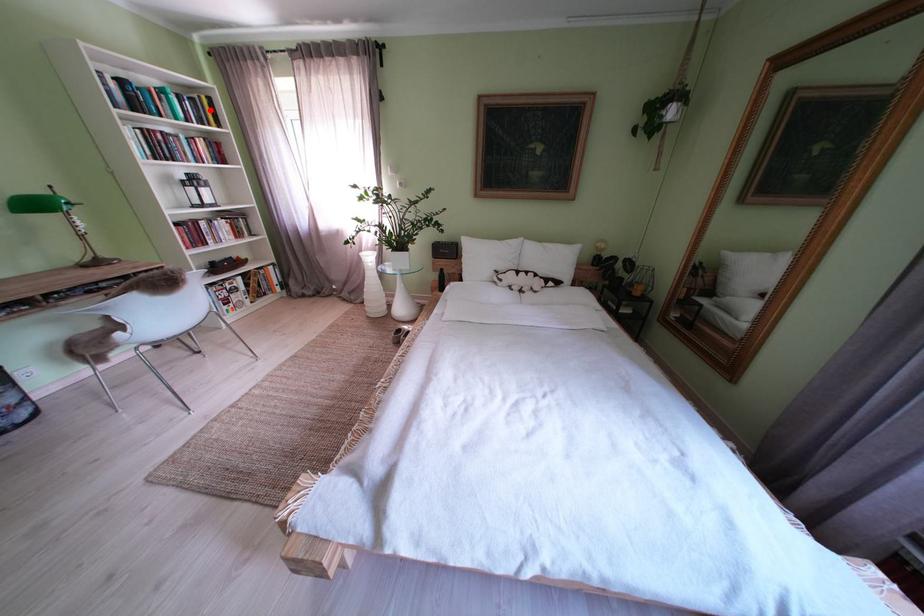
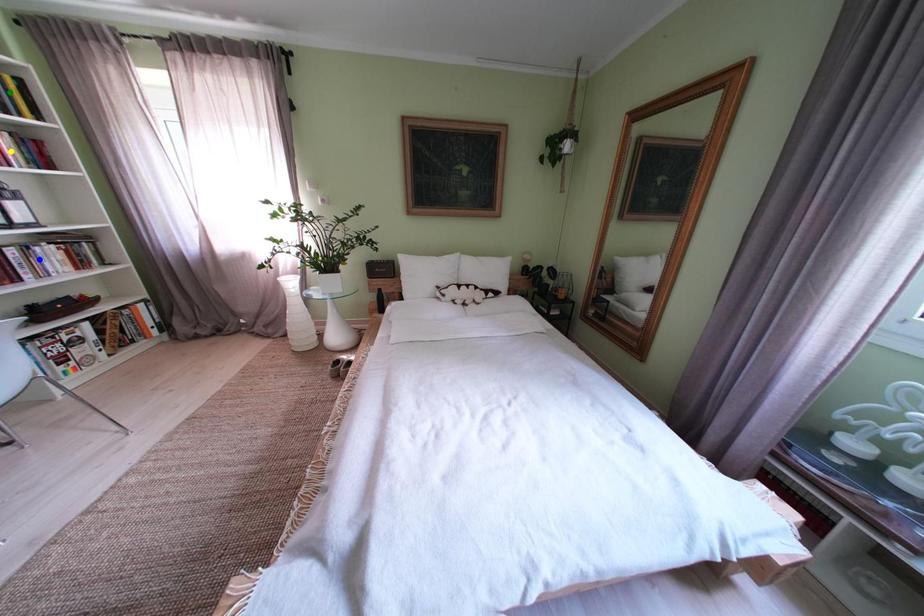
Question: I am providing you with two images of the same scene from different viewpoints. A red point is marked on the first image. You are given multiple points on the second image. In image 2, which mark is for the same physical point as the one in image 1?

Choices:
 (A) blue point
 (B) green point
 (C) yellow point

Answer: (B)